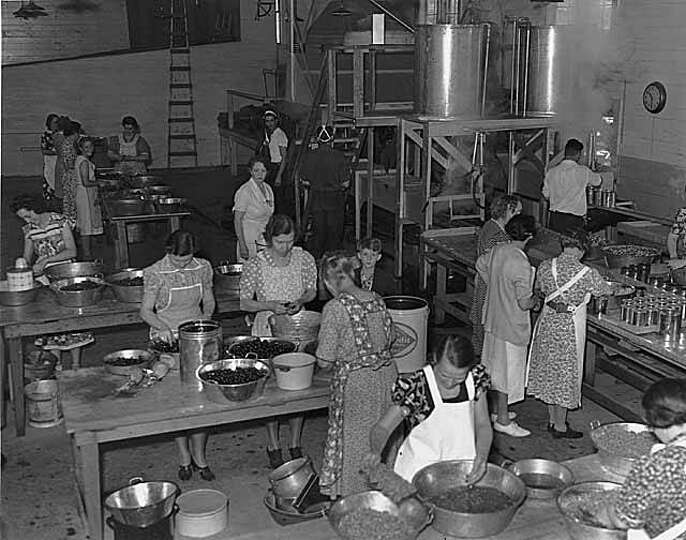
The width and height of the screenshot is (686, 540). Identify the location of walls. (110, 94), (667, 42).